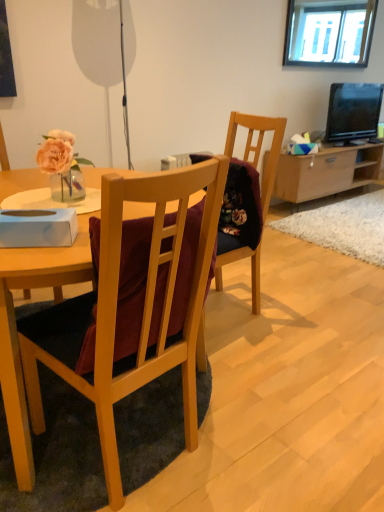
Question: From the image's perspective, would you say light brown wood cabinet at center right is shown under wooden chair at center?

Choices:
 (A) yes
 (B) no

Answer: (B)

Question: Is light brown wood cabinet at center right at the left side of wooden chair at center?

Choices:
 (A) no
 (B) yes

Answer: (A)

Question: Can wooden chair at center be found inside light brown wood cabinet at center right?

Choices:
 (A) no
 (B) yes

Answer: (A)

Question: Considering the relative sizes of light brown wood cabinet at center right and wooden chair at center in the image provided, is light brown wood cabinet at center right smaller than wooden chair at center?

Choices:
 (A) no
 (B) yes

Answer: (A)

Question: From the image's perspective, would you say light brown wood cabinet at center right is positioned over wooden chair at center?

Choices:
 (A) no
 (B) yes

Answer: (B)

Question: In the image, is light brown wood cabinet at center right positioned in front of or behind matte black television at upper right?

Choices:
 (A) behind
 (B) front

Answer: (B)

Question: Is light brown wood cabinet at center right inside the boundaries of matte black television at upper right, or outside?

Choices:
 (A) outside
 (B) inside

Answer: (A)

Question: In terms of width, does light brown wood cabinet at center right look wider or thinner when compared to matte black television at upper right?

Choices:
 (A) wide
 (B) thin

Answer: (A)

Question: Is point (329, 189) positioned closer to the camera than point (359, 117)?

Choices:
 (A) farther
 (B) closer

Answer: (A)

Question: From the image's perspective, is matte black television at upper right above or below wooden chair at center?

Choices:
 (A) above
 (B) below

Answer: (A)

Question: Would you say matte black television at upper right is to the left or to the right of wooden chair at center in the picture?

Choices:
 (A) right
 (B) left

Answer: (A)

Question: From a real-world perspective, is matte black television at upper right positioned above or below wooden chair at center?

Choices:
 (A) below
 (B) above

Answer: (B)

Question: Would you say matte black television at upper right is inside or outside wooden chair at center?

Choices:
 (A) outside
 (B) inside

Answer: (A)

Question: Is point (241, 113) positioned closer to the camera than point (163, 219)?

Choices:
 (A) closer
 (B) farther

Answer: (B)

Question: Considering their positions, is wooden chair at center located in front of or behind wooden chair at center?

Choices:
 (A) behind
 (B) front

Answer: (A)